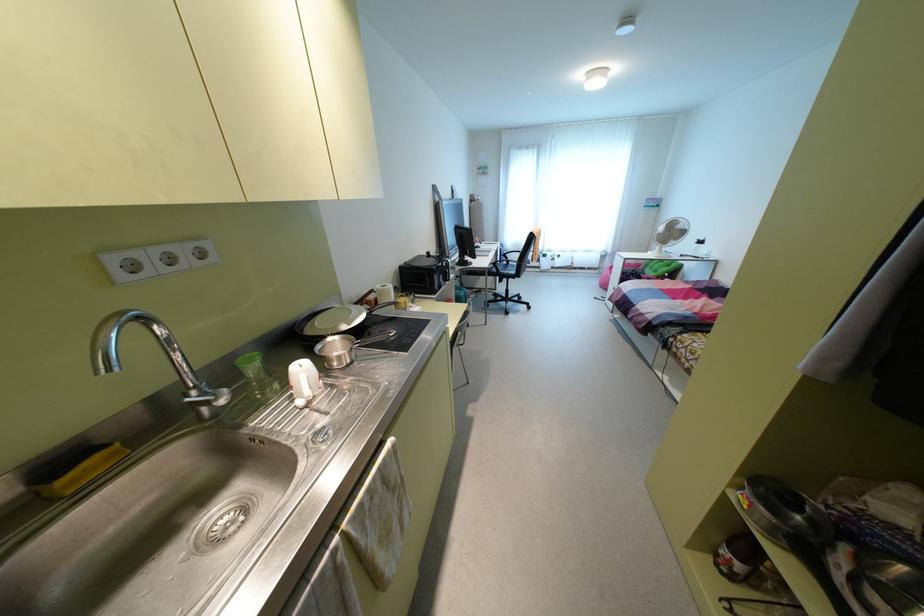
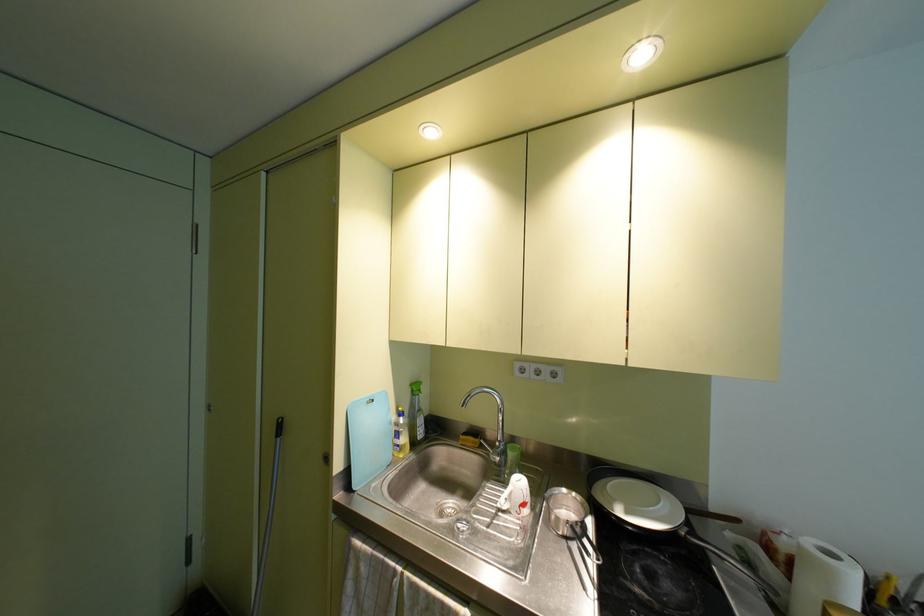
Question: The camera is either moving clockwise (left) or counter-clockwise (right) around the object. The first image is from the beginning of the video and the second image is from the end. Is the camera moving left or right when shooting the video?

Choices:
 (A) Left
 (B) Right

Answer: (B)